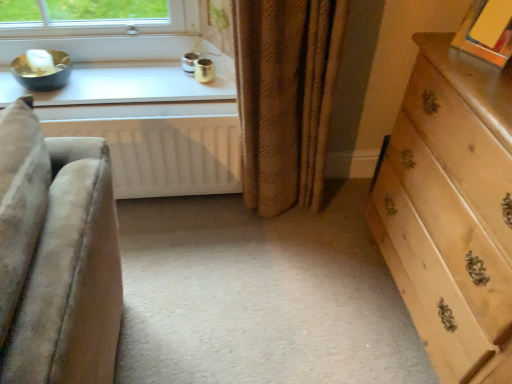
Find the location of a particular element. This screenshot has height=384, width=512. free space on the front side of white matte radiator at lower center is located at coordinates (164, 268).